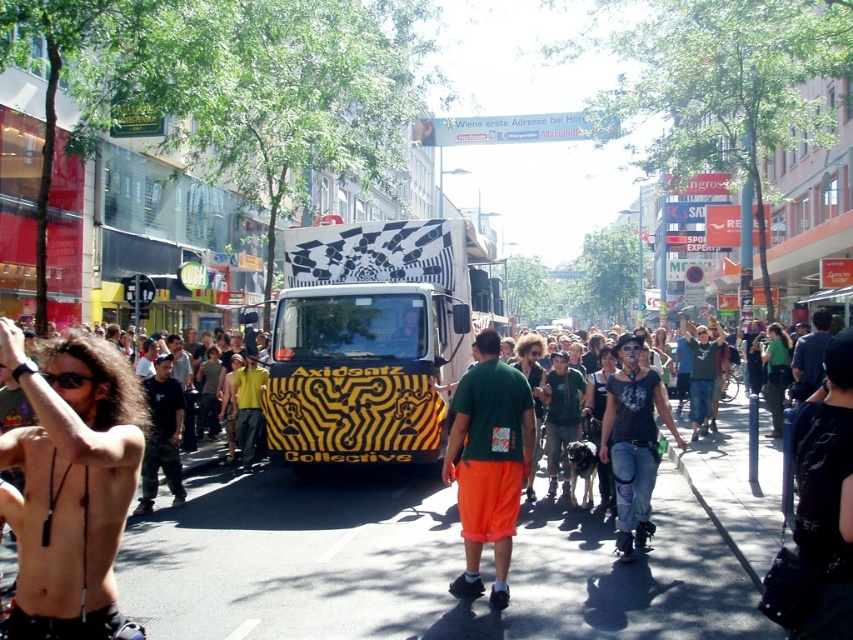
Question: Does green fabric shirt at center appear on the right side of dark blue shirt at center?

Choices:
 (A) yes
 (B) no

Answer: (B)

Question: Among these points, which one is nearest to the camera?

Choices:
 (A) (166, 381)
 (B) (798, 358)

Answer: (A)

Question: Considering the relative positions of yellow and black striped bus at center and dark blue shirt at center in the image provided, where is yellow and black striped bus at center located with respect to dark blue shirt at center?

Choices:
 (A) left
 (B) right

Answer: (A)

Question: Which of the following is the closest to the observer?

Choices:
 (A) dark blue shirt at center
 (B) shiny black hair at left
 (C) yellow matte truck at center

Answer: (B)

Question: From the image, what is the correct spatial relationship of yellow and black striped bus at center in relation to dark blue jeans at center?

Choices:
 (A) above
 (B) below

Answer: (A)

Question: Which point appears closest to the camera in this image?

Choices:
 (A) (142, 497)
 (B) (27, 442)

Answer: (B)